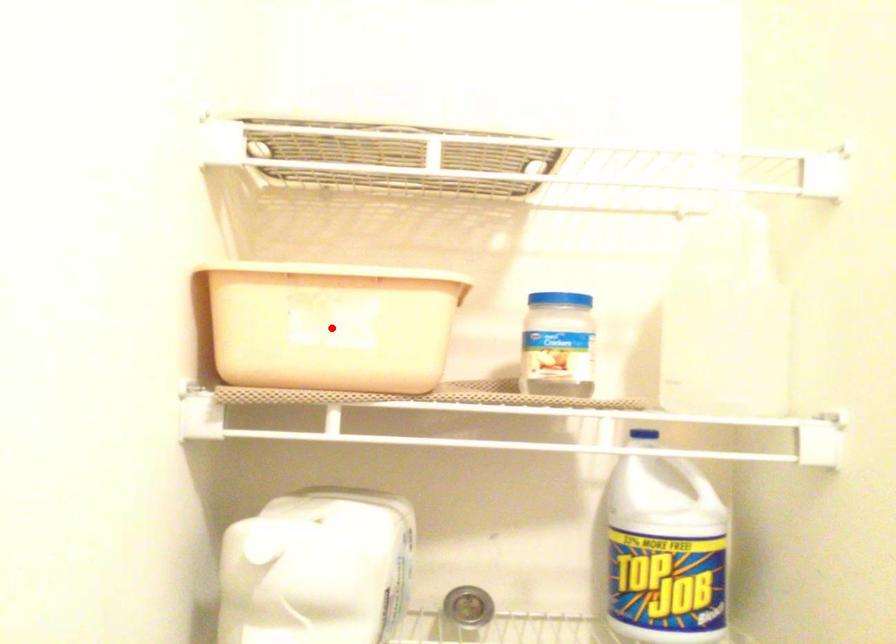
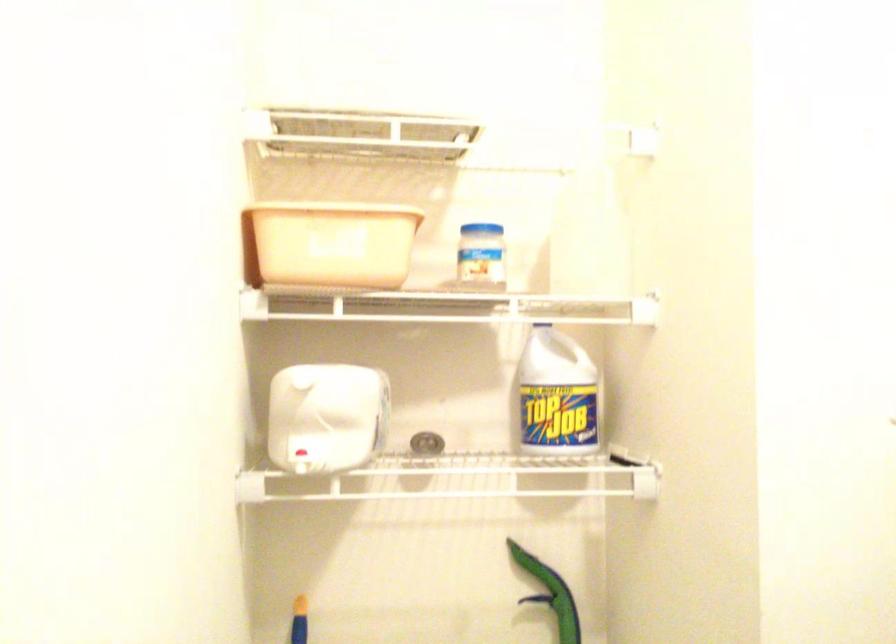
Locate, in the second image, the point that corresponds to the highlighted location in the first image.

(333, 243)